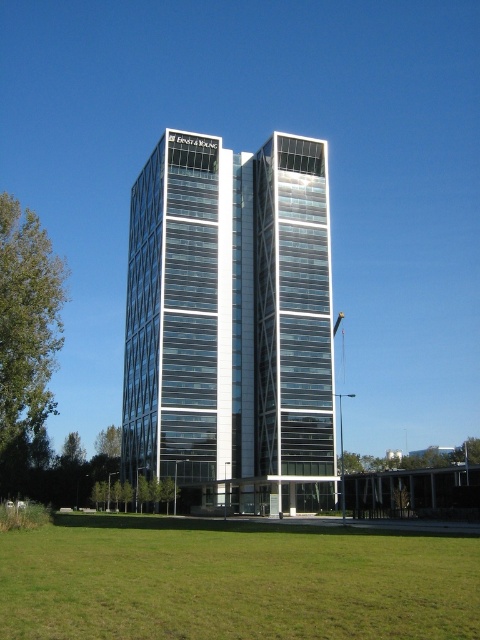
Consider the image. Which of these two, transparent glass building at center or green grass at lower center, stands shorter?

With less height is green grass at lower center.

What do you see at coordinates (231, 324) in the screenshot? This screenshot has width=480, height=640. I see `transparent glass building at center` at bounding box center [231, 324].

Where is `transparent glass building at center`? transparent glass building at center is located at coordinates (231, 324).